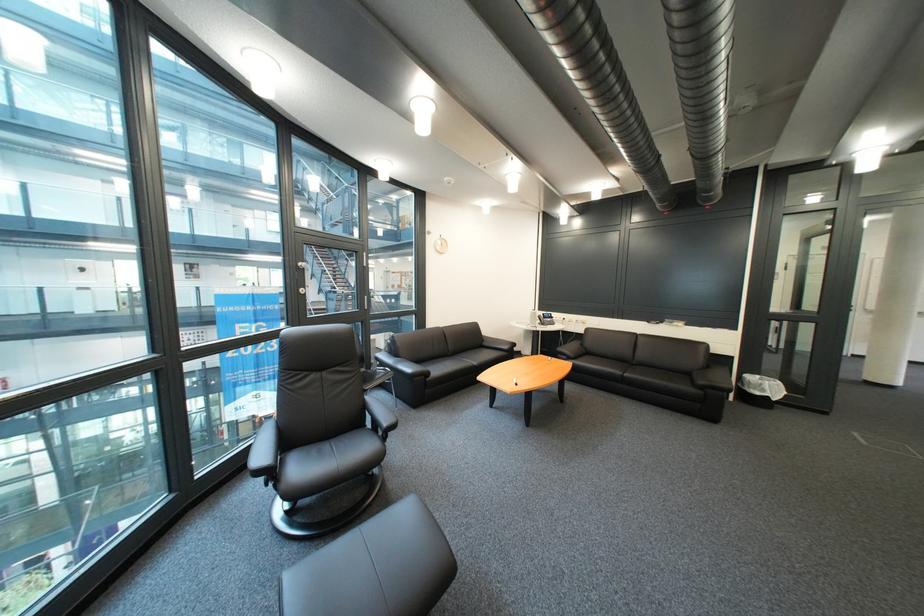
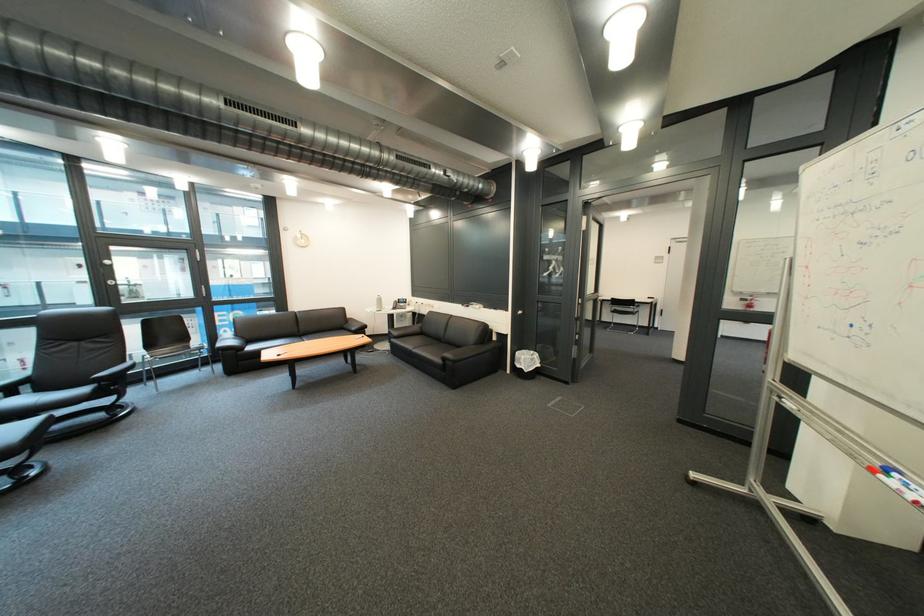
Where in the second image is the point corresponding to point (781, 389) from the first image?

(536, 363)